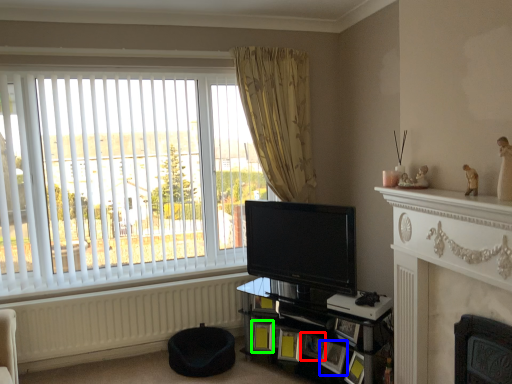
Question: Which object is the farthest from picture frame (highlighted by a red box)? Choose among these: picture frame (highlighted by a blue box) or picture frame (highlighted by a green box).

Choices:
 (A) picture frame
 (B) picture frame

Answer: (B)